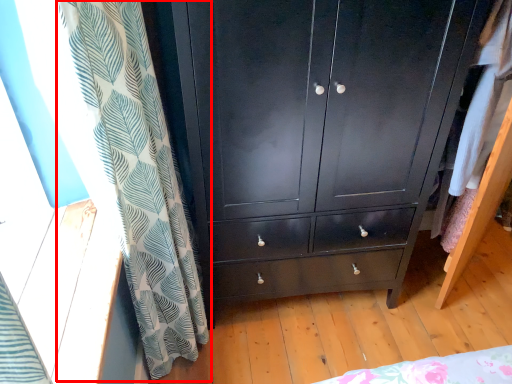
Question: Where is curtain (annotated by the red box) located in relation to chest of drawers in the image?

Choices:
 (A) right
 (B) left

Answer: (B)